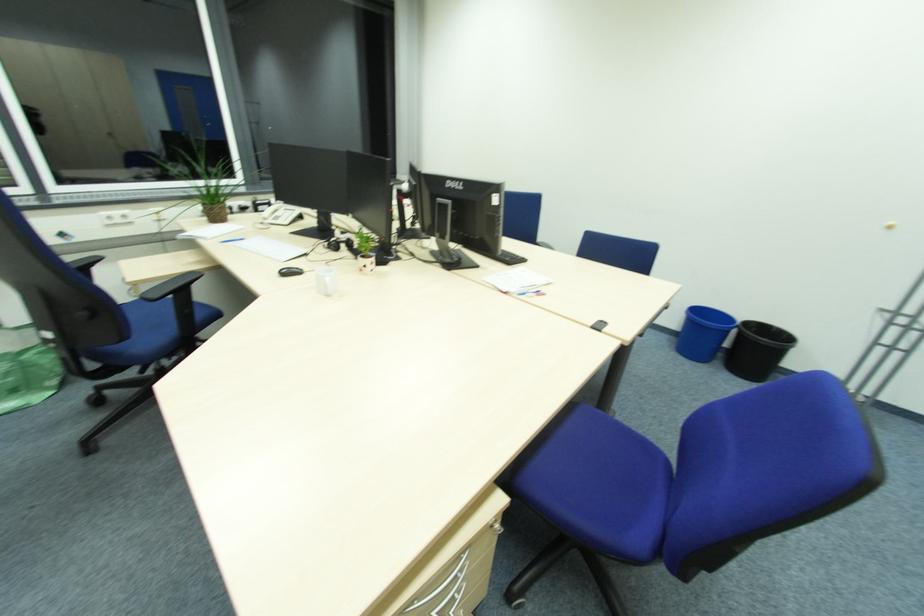
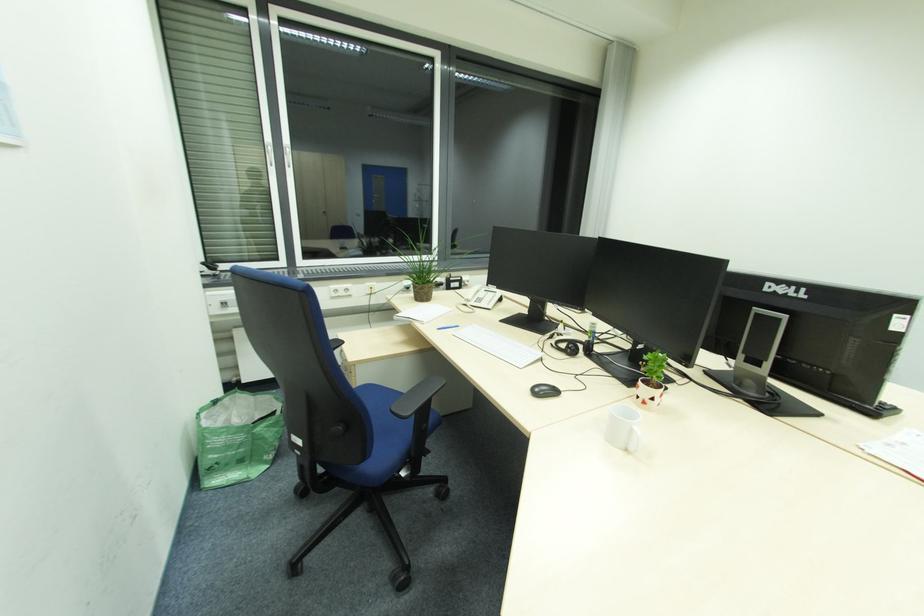
The images are taken continuously from a first-person perspective. In which direction are you moving?

The movement direction of the cameraman is left, forward.